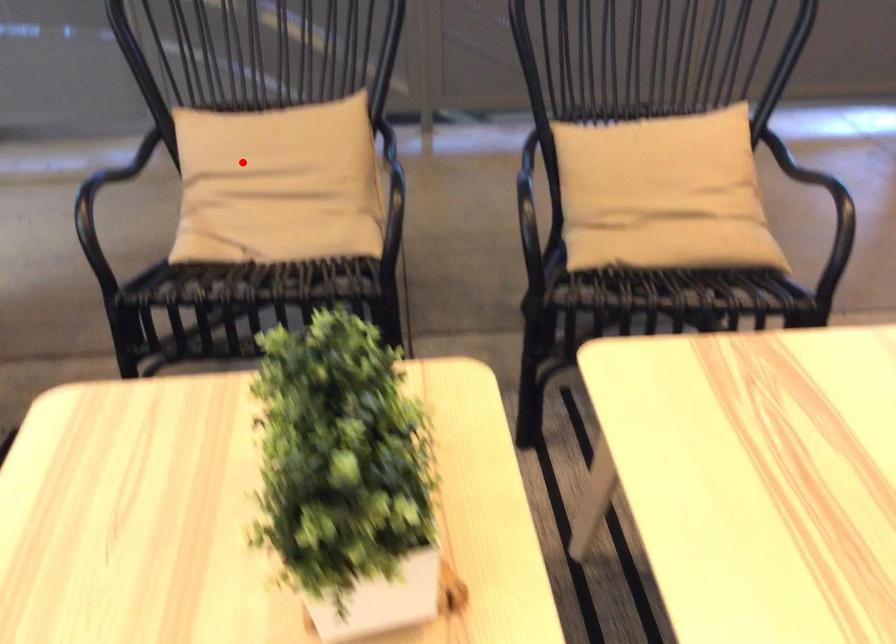
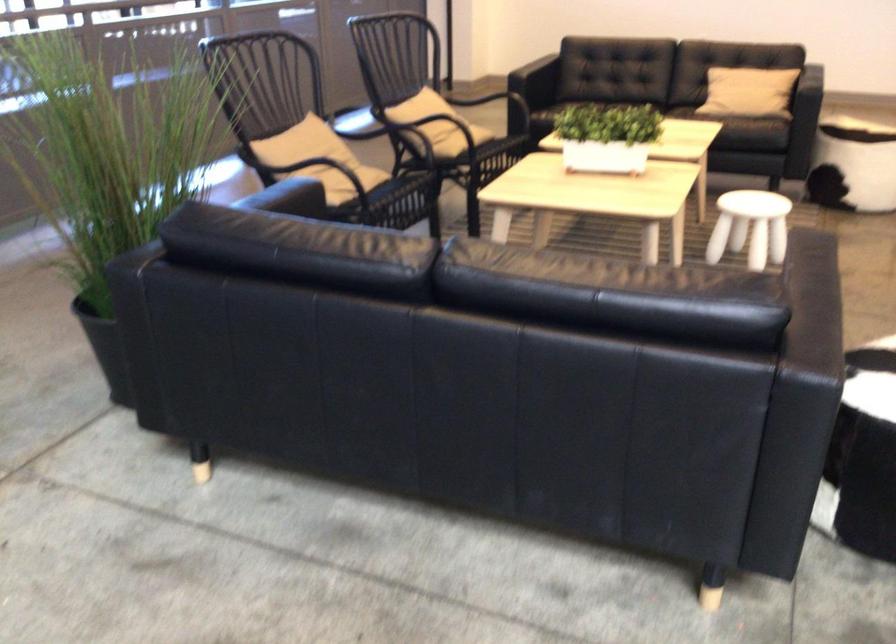
In the second image, find the point that corresponds to the highlighted location in the first image.

(308, 153)